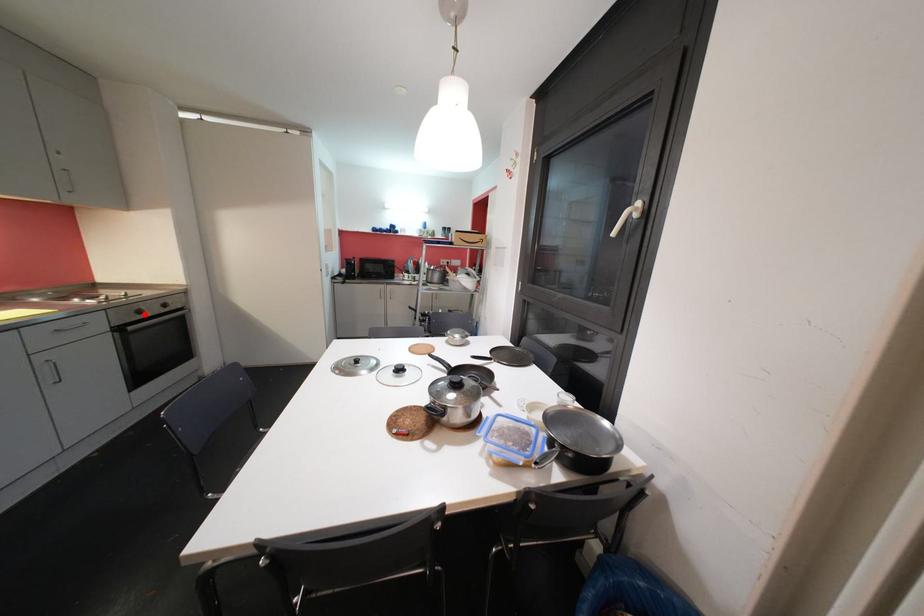
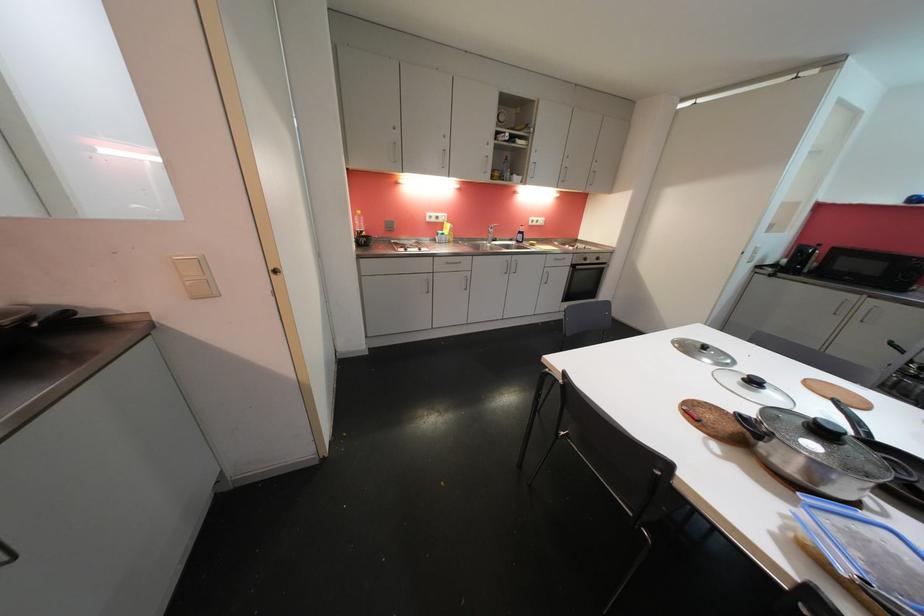
Where in the second image is the point corresponding to the highlighted location from the first image?

(590, 262)